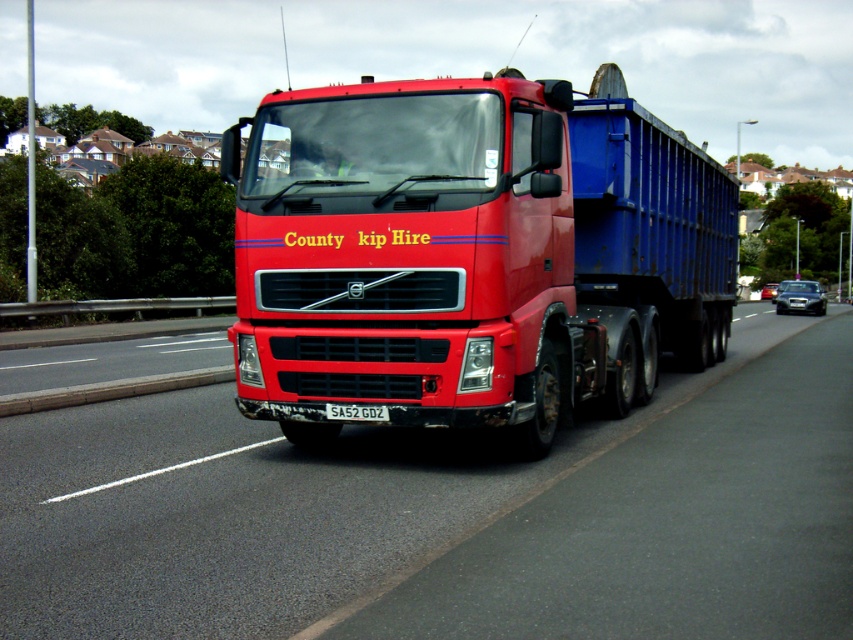
Question: Which object is farther from the camera taking this photo?

Choices:
 (A) white plastic license plate at center
 (B) shiny red truck at center
 (C) metallic asphalt highway at center

Answer: (A)

Question: Is metallic asphalt highway at center wider than shiny red truck at center?

Choices:
 (A) yes
 (B) no

Answer: (B)

Question: Considering the relative positions of metallic asphalt highway at center and shiny red truck at center in the image provided, where is metallic asphalt highway at center located with respect to shiny red truck at center?

Choices:
 (A) below
 (B) above

Answer: (A)

Question: Among these points, which one is nearest to the camera?

Choices:
 (A) (387, 410)
 (B) (241, 392)

Answer: (A)

Question: Is shiny red truck at center bigger than white plastic license plate at center?

Choices:
 (A) yes
 (B) no

Answer: (A)

Question: Which object appears closest to the camera in this image?

Choices:
 (A) shiny red truck at center
 (B) white plastic license plate at center

Answer: (A)